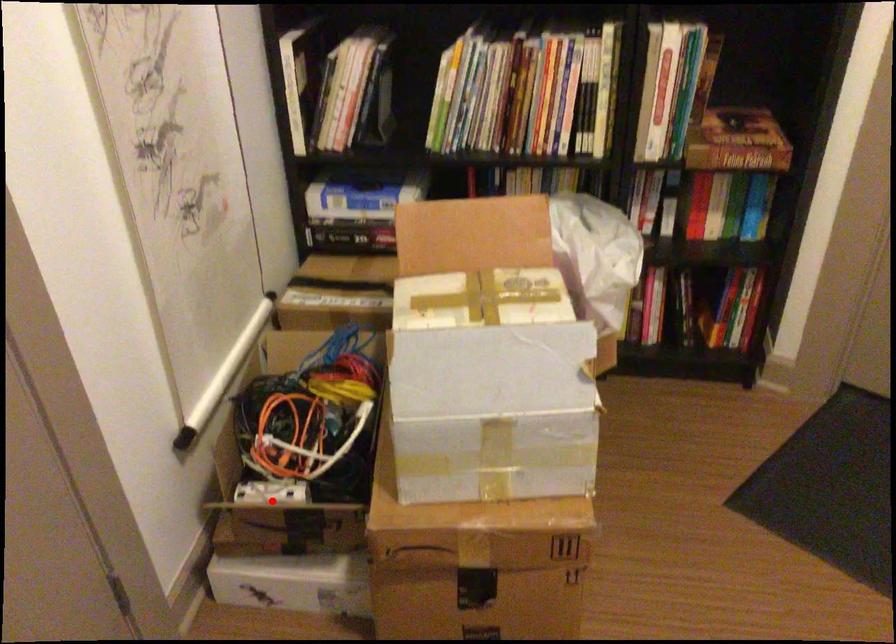
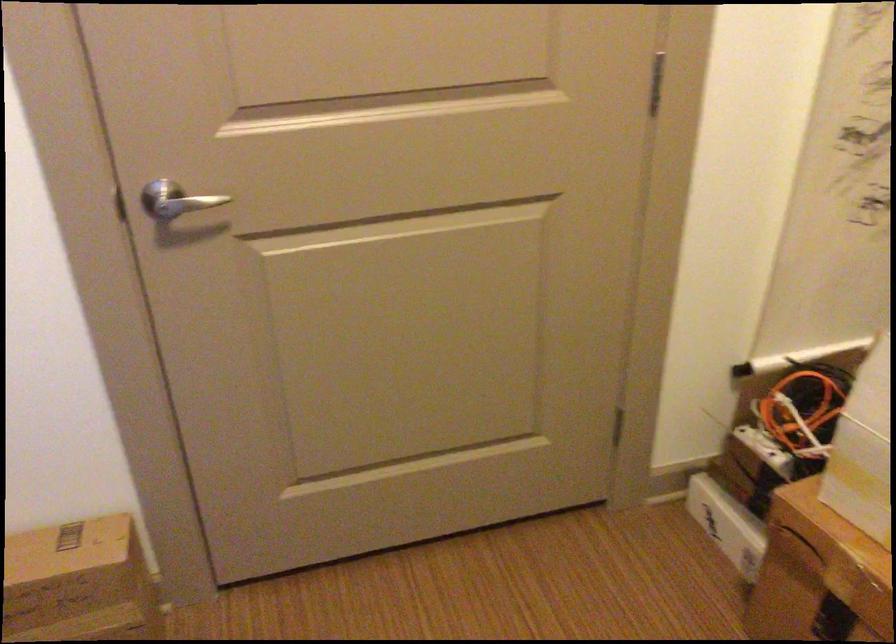
The point at the highlighted location is marked in the first image. Where is the corresponding point in the second image?

(764, 450)